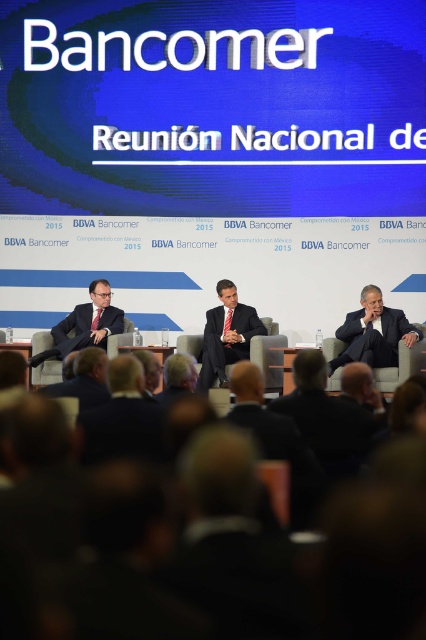
Between dark blue suit at center and matte black suit at left, which one is positioned higher?

Positioned higher is matte black suit at left.

Does dark blue suit at center have a greater height compared to matte black suit at left?

No.

This screenshot has height=640, width=426. Find the location of `dark blue suit at center`. dark blue suit at center is located at coordinates (123, 419).

What are the coordinates of `dark blue suit at center` in the screenshot? It's located at (123, 419).

Is matte black suit at center thinner than matte black suit at left?

A: Indeed, matte black suit at center has a lesser width compared to matte black suit at left.

Image resolution: width=426 pixels, height=640 pixels. I want to click on matte black suit at center, so click(x=227, y=336).

Which is below, matte black suit at right or matte black suit at center?

matte black suit at center

Who is higher up, matte black suit at right or matte black suit at center?

matte black suit at right is higher up.

Between point (354, 344) and point (218, 374), which one is positioned behind?

Point (218, 374)

The image size is (426, 640). What are the coordinates of `matte black suit at right` in the screenshot? It's located at (374, 332).